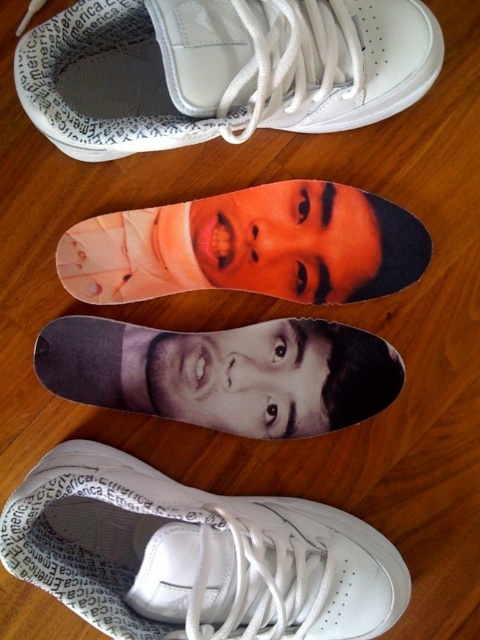
In the scene shown: Which is more to the right, white leather shoe at upper center or black matte selfie at center?

white leather shoe at upper center

Does white leather shoe at upper center lie in front of black matte selfie at center?

Yes, it is in front of black matte selfie at center.

Is point (287, 125) more distant than point (252, 324)?

No, it is not.

Locate an element on the screen. Image resolution: width=480 pixels, height=640 pixels. white leather shoe at upper center is located at coordinates (120, 76).

Can you confirm if white leather shoe at lower center is bigger than orange matte face at center?

Indeed, white leather shoe at lower center has a larger size compared to orange matte face at center.

Is white leather shoe at lower center to the right of orange matte face at center from the viewer's perspective?

No, white leather shoe at lower center is not to the right of orange matte face at center.

Is point (24, 524) behind point (191, 230)?

No, (24, 524) is in front of (191, 230).

Where is `white leather shoe at lower center`? The height and width of the screenshot is (640, 480). white leather shoe at lower center is located at coordinates (194, 556).

Can you confirm if white leather shoe at upper center is smaller than orange matte face at center?

Incorrect, white leather shoe at upper center is not smaller in size than orange matte face at center.

Is white leather shoe at upper center thinner than orange matte face at center?

No, white leather shoe at upper center is not thinner than orange matte face at center.

What are the coordinates of `white leather shoe at upper center` in the screenshot? It's located at point(120,76).